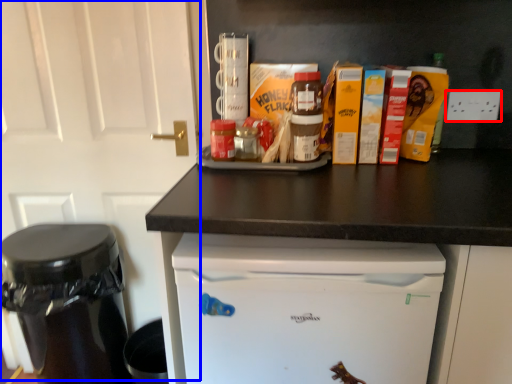
Question: Which object is further to the camera taking this photo, electric outlet (highlighted by a red box) or door (highlighted by a blue box)?

Choices:
 (A) electric outlet
 (B) door

Answer: (A)